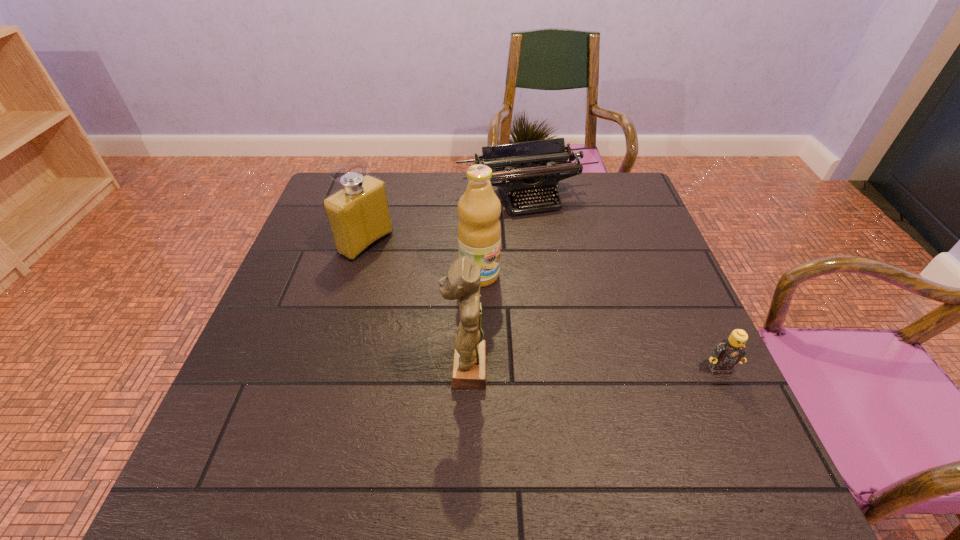
Locate an element on the screen. The height and width of the screenshot is (540, 960). vacant space at the far left corner of the desktop is located at coordinates [314, 212].

Identify the location of vacant space at the near right corner of the desktop. The width and height of the screenshot is (960, 540). (722, 406).

Where is `free point between the shortest object and the perfume`? The width and height of the screenshot is (960, 540). free point between the shortest object and the perfume is located at coordinates (542, 306).

This screenshot has width=960, height=540. In order to click on vacant space that is in between the rightmost object and the leftmost object in this screenshot , I will do `click(542, 306)`.

Find the location of a particular element. Image resolution: width=960 pixels, height=540 pixels. free space between the perfume and the olive oil is located at coordinates (422, 259).

The height and width of the screenshot is (540, 960). What are the coordinates of `free area in between the olive oil and the Lego` in the screenshot? It's located at (599, 322).

Where is `free space that is in between the Lego and the olive oil`? The image size is (960, 540). free space that is in between the Lego and the olive oil is located at coordinates (599, 322).

This screenshot has height=540, width=960. I want to click on vacant point located between the rightmost object and the olive oil, so click(599, 322).

Find the location of a particular element. The height and width of the screenshot is (540, 960). vacant space in between the second shortest object and the figurine is located at coordinates (496, 282).

At what (x,y) coordinates should I click in order to perform the action: click on empty space between the olive oil and the shortest object. Please return your answer as a coordinate pair (x, y). This screenshot has height=540, width=960. Looking at the image, I should click on (599, 322).